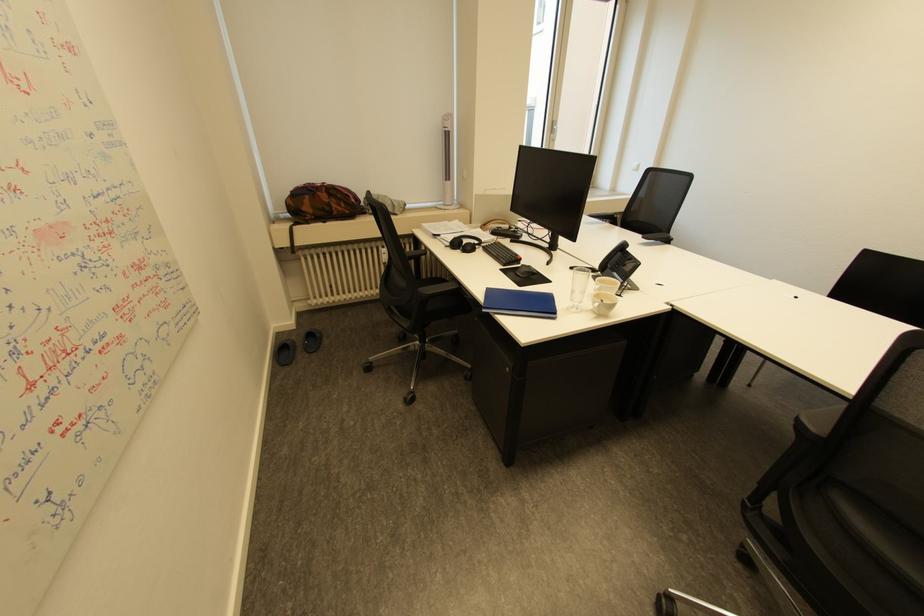
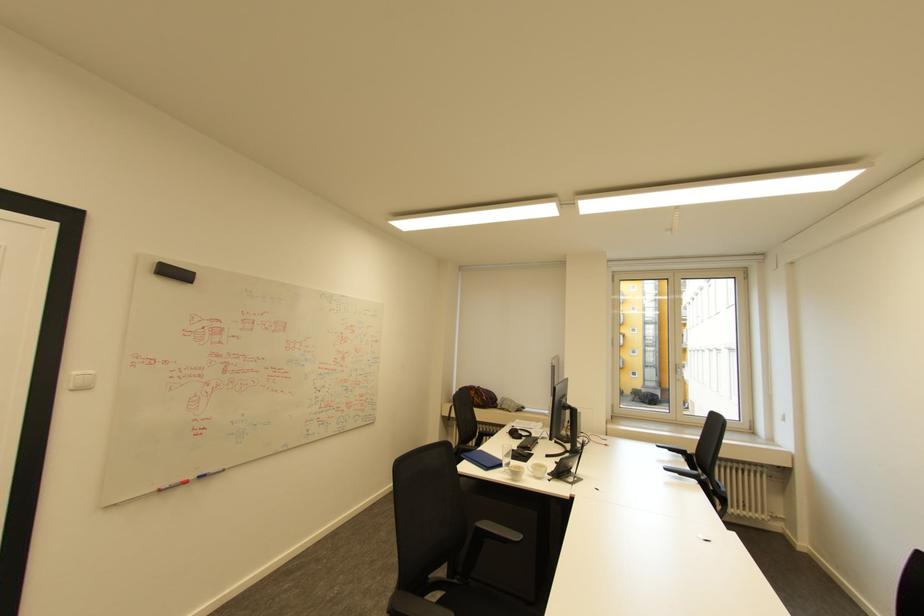
The point at [472,240] is marked in the first image. Where is the corresponding point in the second image?

(526, 432)